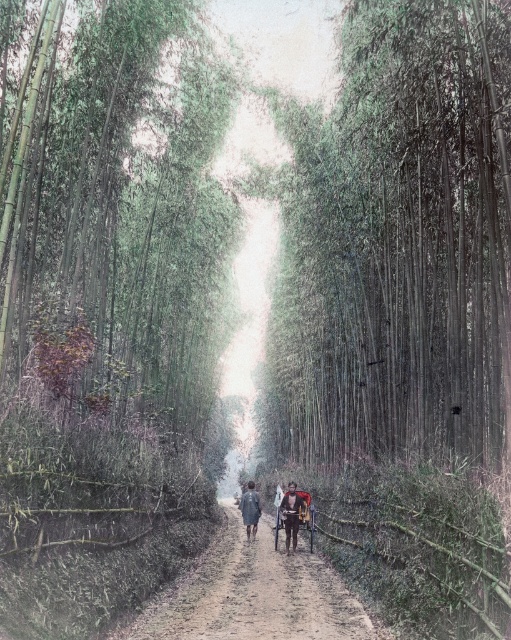
In the scene shown: Between dusty brown dirt road at center and dark gray fabric coat at center, which one appears on the left side from the viewer's perspective?

dark gray fabric coat at center is more to the left.

Between dusty brown dirt road at center and dark gray fabric coat at center, which one is positioned lower?

A: Positioned lower is dark gray fabric coat at center.

Where is `dusty brown dirt road at center`? This screenshot has width=511, height=640. dusty brown dirt road at center is located at coordinates (251, 595).

Find the location of a particular element. dusty brown dirt road at center is located at coordinates pyautogui.click(x=251, y=595).

Does dusty brown dirt road at center come in front of wooden cart at center?

Yes, it is.

Who is higher up, dusty brown dirt road at center or wooden cart at center?

wooden cart at center

Find the location of a particular element. dusty brown dirt road at center is located at coordinates (251, 595).

Locate an element on the screen. dusty brown dirt road at center is located at coordinates (251, 595).

Is green matte bamboo at center behind wooden cart at center?

No, it is in front of wooden cart at center.

Does point (401, 12) lie in front of point (292, 506)?

Yes, it is in front of point (292, 506).

Where is `green matte bamboo at center`? The image size is (511, 640). green matte bamboo at center is located at coordinates (396, 243).